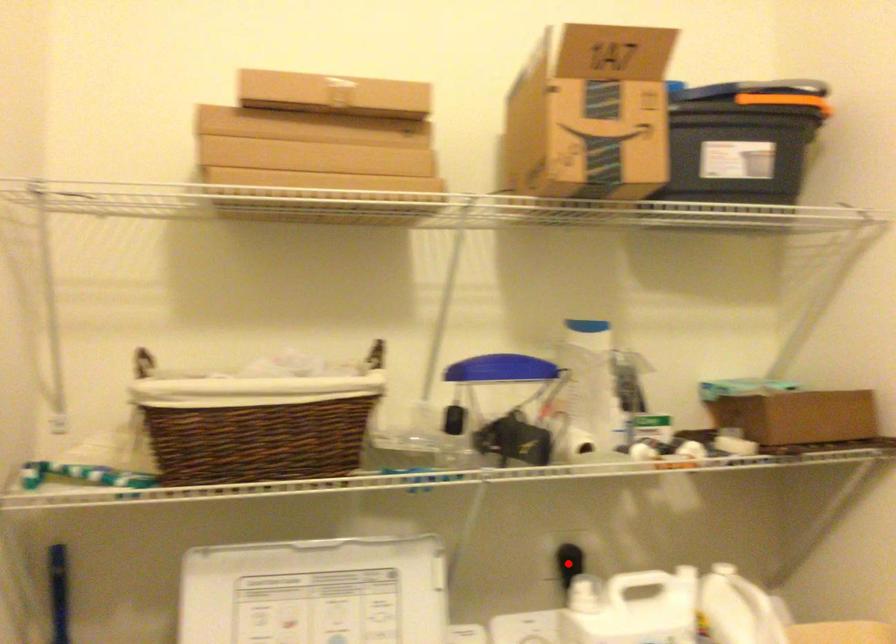
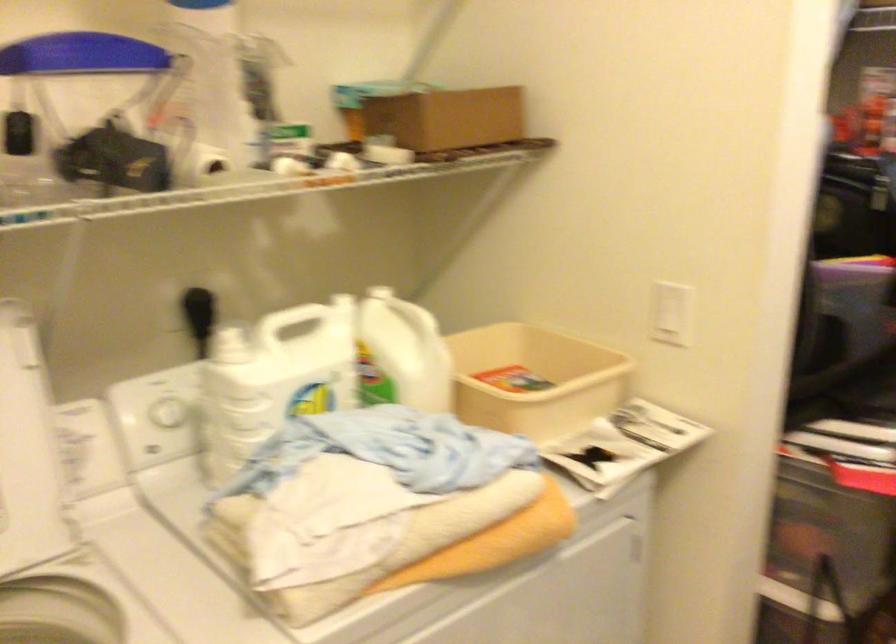
Question: I am providing you with two images of the same scene from different viewpoints. A red point is marked on the first image. At the location where the point appears in image 1, is it still visible in image 2?

Choices:
 (A) Yes
 (B) No

Answer: (A)